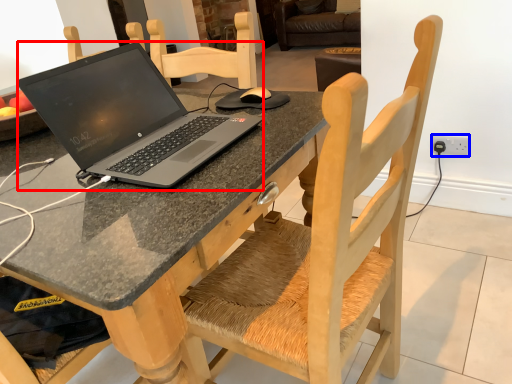
Question: Among these objects, which one is farthest to the camera, laptop (highlighted by a red box) or electric outlet (highlighted by a blue box)?

Choices:
 (A) laptop
 (B) electric outlet

Answer: (B)